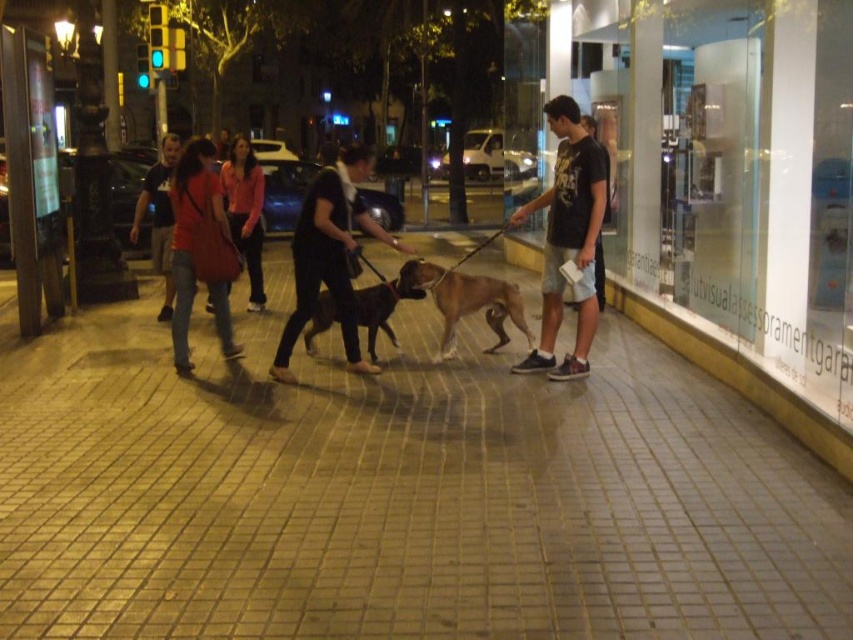
Can you confirm if matte red jacket at center is taller than matte pink shirt at center?

Indeed, matte red jacket at center has a greater height compared to matte pink shirt at center.

Is matte red jacket at center smaller than matte pink shirt at center?

Actually, matte red jacket at center might be larger than matte pink shirt at center.

Is point (186, 280) farther from camera compared to point (229, 198)?

No, it is not.

Locate an element on the screen. matte red jacket at center is located at coordinates (200, 250).

Is brown fur dog at center taller than matte pink shirt at center?

Correct, brown fur dog at center is much taller as matte pink shirt at center.

Based on the photo, who is more distant from viewer, (479,308) or (228,212)?

The point (228,212) is more distant.

I want to click on brown fur dog at center, so click(465, 300).

Is dark gray fabric pants at center shorter than matte red jacket at center?

Yes.

Which is in front, point (305, 280) or point (202, 232)?

Point (305, 280) is in front.

Is point (345, 298) in front of point (241, 348)?

Yes, point (345, 298) is in front of point (241, 348).

Where is `dark gray fabric pants at center`? Image resolution: width=853 pixels, height=640 pixels. dark gray fabric pants at center is located at coordinates (329, 256).